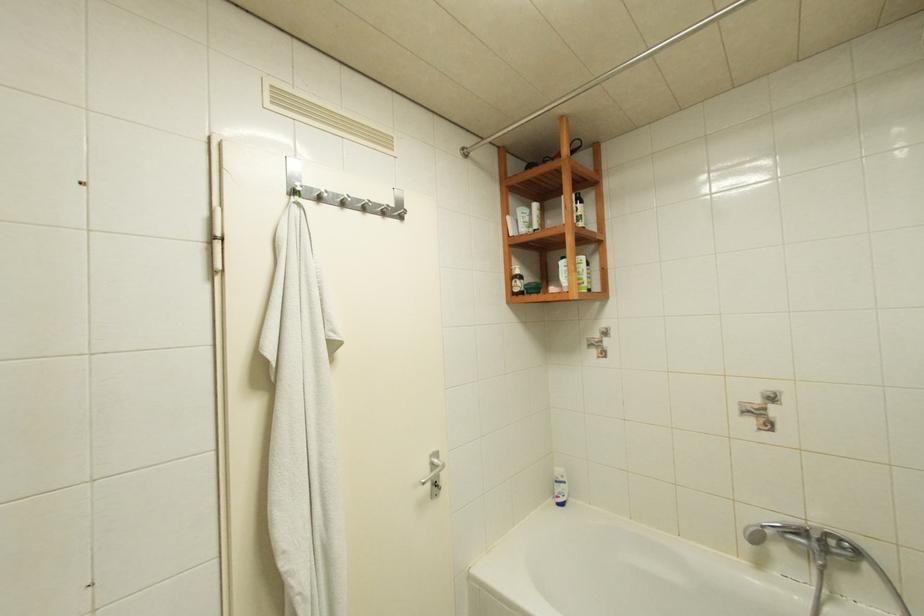
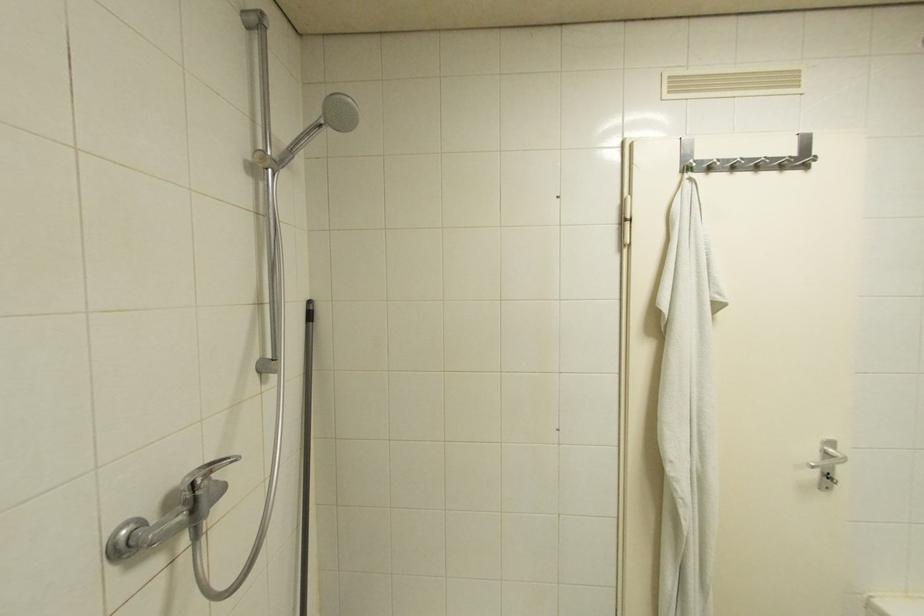
Question: How did the camera likely rotate?

Choices:
 (A) Left
 (B) Right
 (C) Up
 (D) Down

Answer: (A)